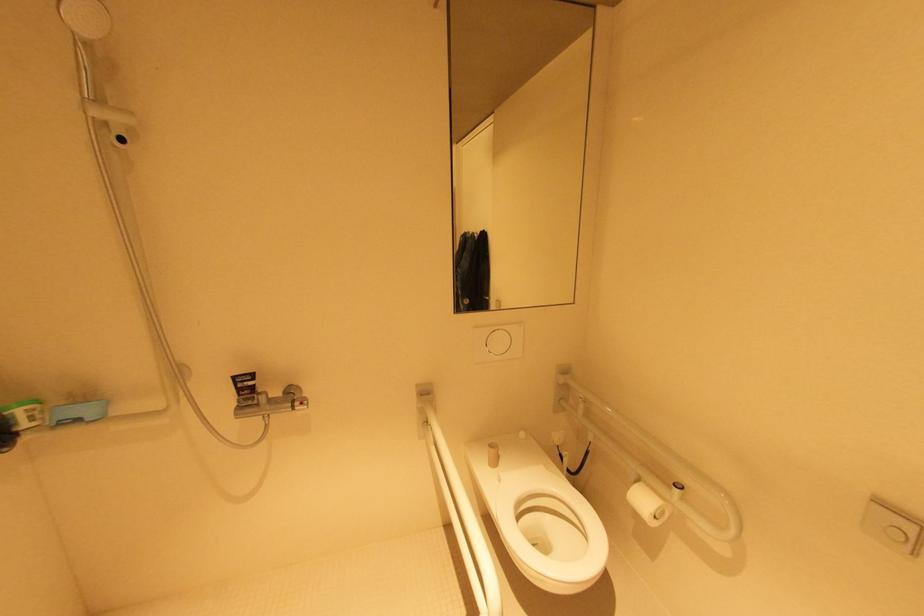
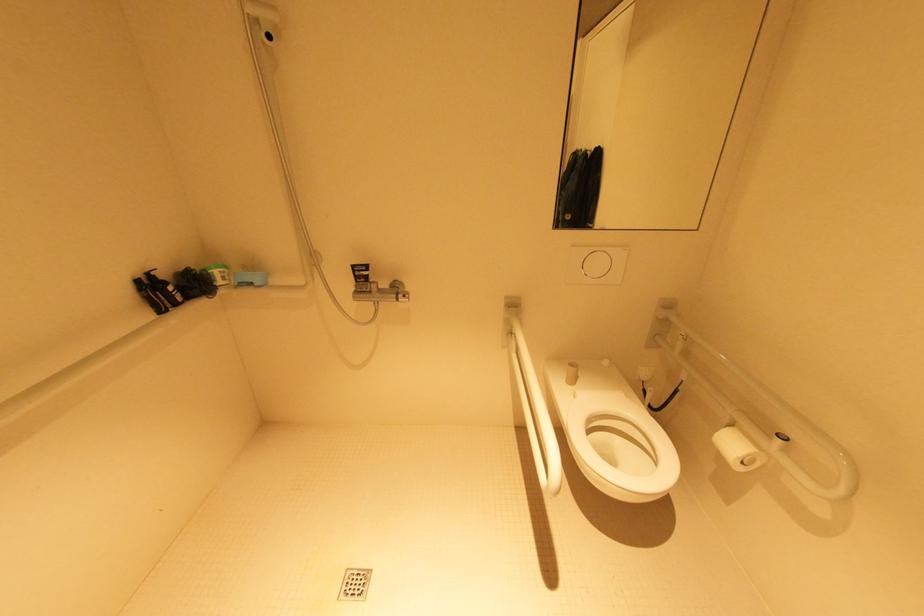
Question: The images are taken continuously from a first-person perspective. In which direction are you moving?

Choices:
 (A) Left
 (B) Right
 (C) Forward
 (D) Backward

Answer: (D)